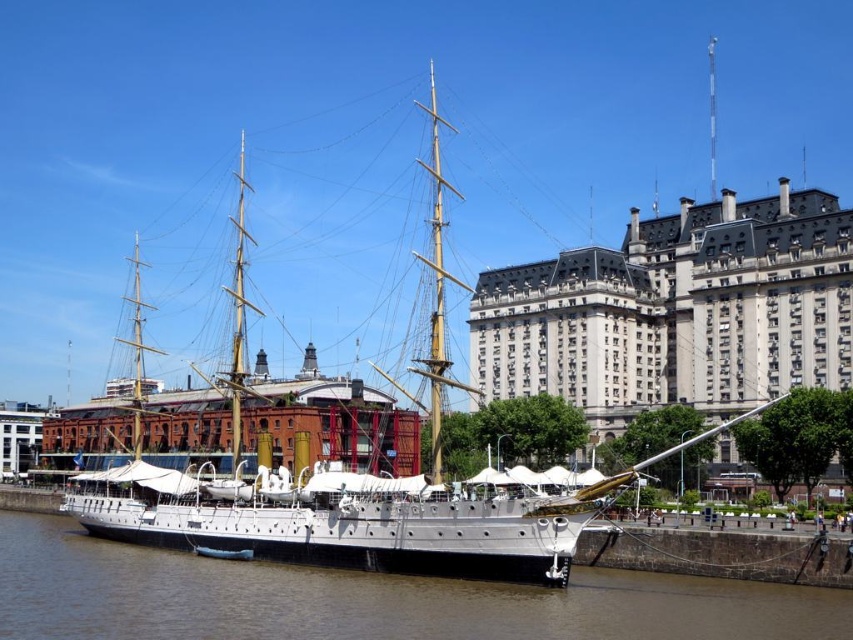
You are planning to install a flagpole on the tallest structure between the white stone building at center and the white polished wood ship at center. Which structure should you choose?

The white polished wood ship at center is taller than the white stone building at center, so you should install the flagpole on the white polished wood ship at center.

You are standing at the point marked as point (366, 600) on the image. What do you see directly below you?

At point (366, 600) lies brown water at lower center.

Consider the image. You are standing on the waterfront near the historic ship and want to take a photo. You notice two points marked as point 1 at coordinates point (369, 636) and point 2 at coordinates point (366, 497). Which point should you stand closer to if you want to be nearer to the camera for a better selfie?

You should stand closer to point 1 at coordinates point (369, 636) because it is closer to the camera than point 2 at coordinates point (366, 497).